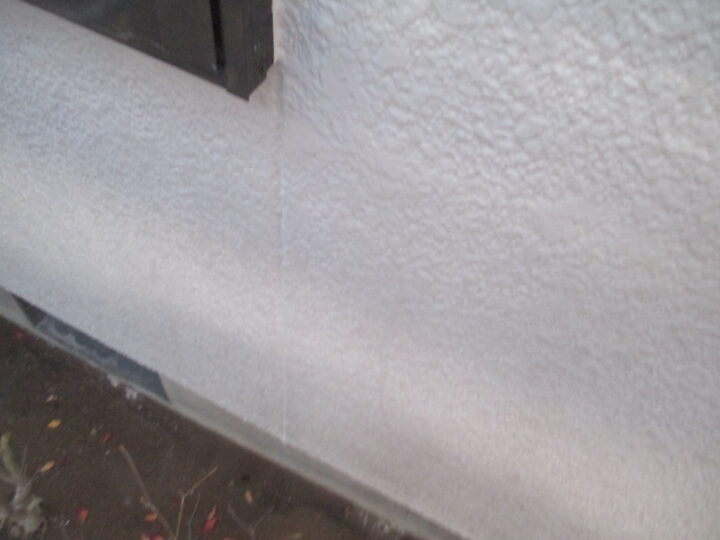
This screenshot has width=720, height=540. Find the location of `white stucco`. white stucco is located at coordinates (206, 326).